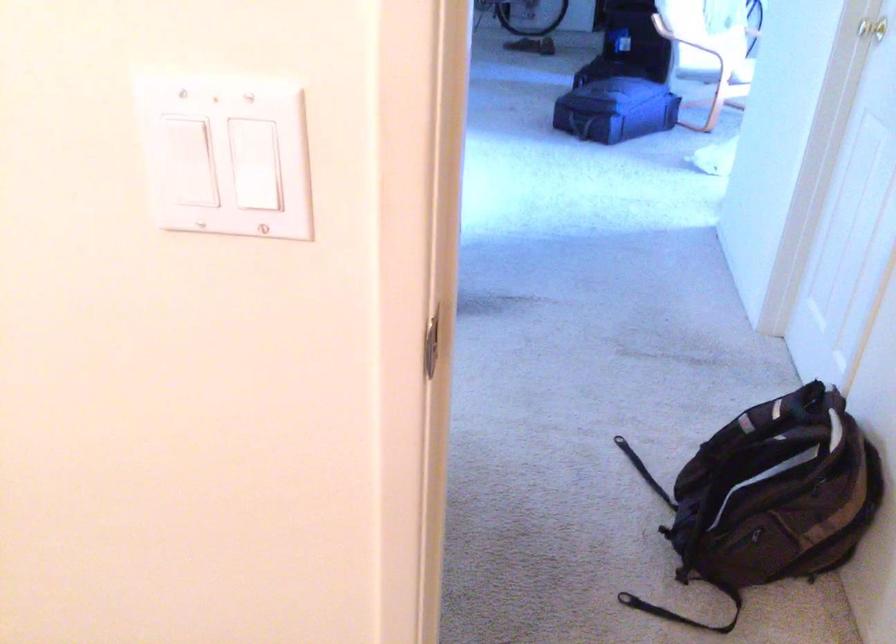
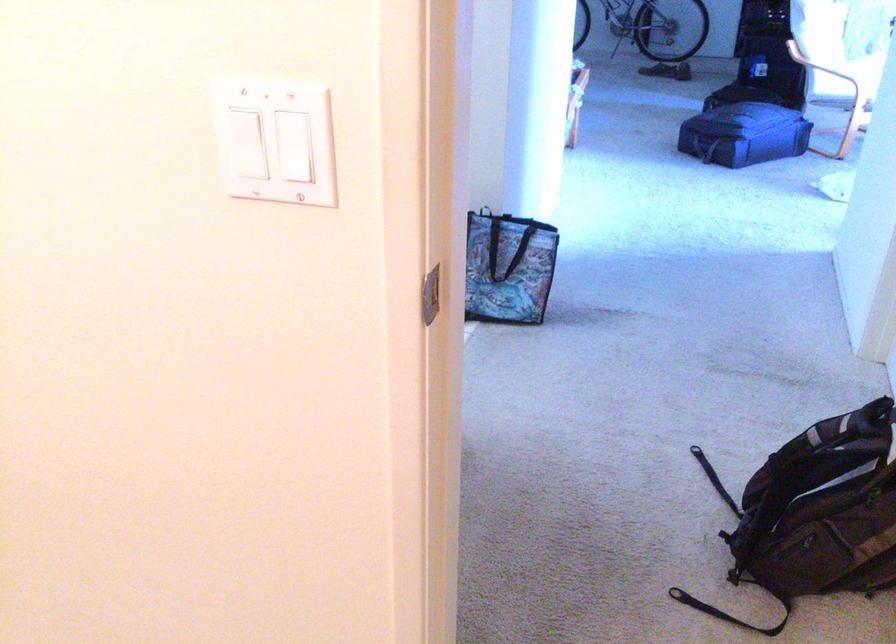
The point at (199,184) is marked in the first image. Where is the corresponding point in the second image?

(242, 143)